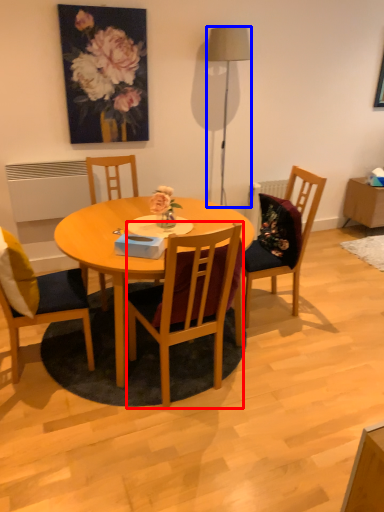
Question: Which object appears closest to the camera in this image, chair (highlighted by a red box) or lamp (highlighted by a blue box)?

Choices:
 (A) chair
 (B) lamp

Answer: (A)